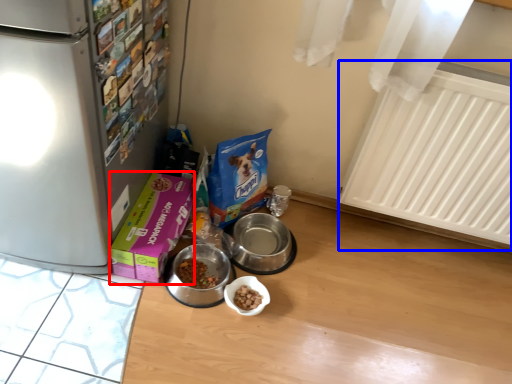
Question: Which object is further to the camera taking this photo, box (highlighted by a red box) or radiator (highlighted by a blue box)?

Choices:
 (A) box
 (B) radiator

Answer: (A)